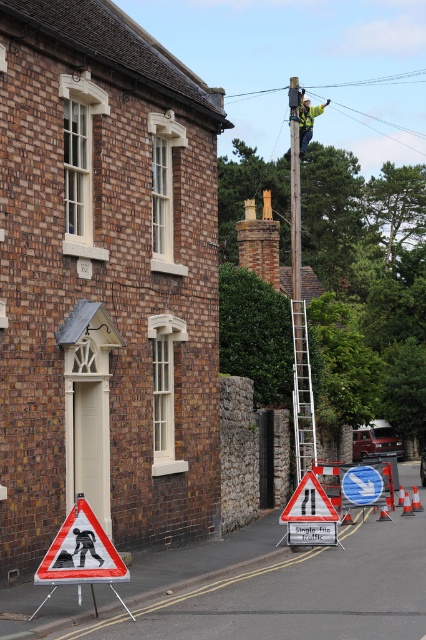
You are a pedestrian walking towards the residential building and see the silver metallic ladder at center and the white plastic pedestrian crossing sign at lower left. Which object is closer to you as you approach the building?

The silver metallic ladder at center is closer to you because it is further to the viewer than the white plastic pedestrian crossing sign at lower left, meaning it appears nearer in your line of sight.

You are driving a car and need to park in this area. You see the silver metallic ladder at center and the white plastic pedestrian crossing sign at lower left. Which object is closer to the left side of the road?

The silver metallic ladder at center is closer to the left side of the road because it is positioned to the left of the white plastic pedestrian crossing sign at lower left.

You are a pedestrian approaching the scene. You see the white plastic pedestrian crossing sign at lower left and the yellow reflective safety vest at upper center. Which object is positioned to the left when viewed from your perspective?

The white plastic pedestrian crossing sign at lower left is positioned to the left of the yellow reflective safety vest at upper center.